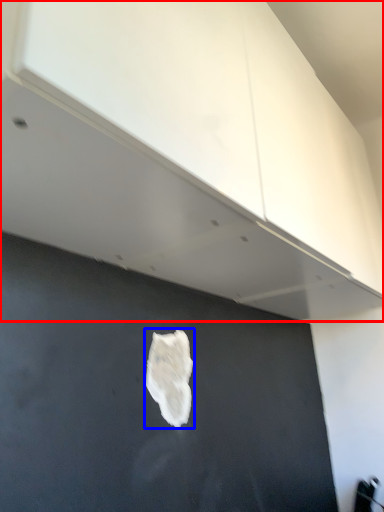
Question: Which of the following is the farthest to the observer, cabinetry (highlighted by a red box) or patch (highlighted by a blue box)?

Choices:
 (A) cabinetry
 (B) patch

Answer: (B)